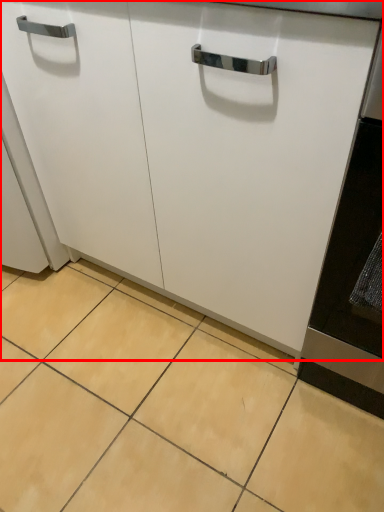
Question: From the image's perspective, where is cabinetry (annotated by the red box) located relative to ceramic tile?

Choices:
 (A) above
 (B) below

Answer: (A)